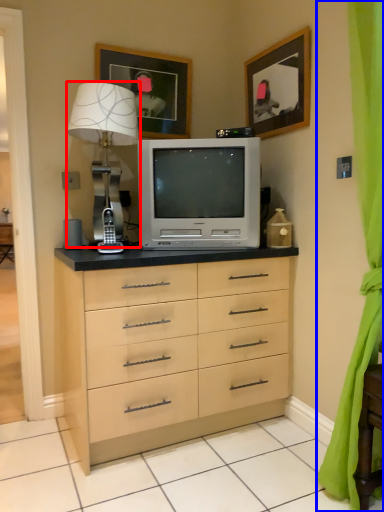
Question: Which of the following is the closest to the observer, table lamp (highlighted by a red box) or curtain (highlighted by a blue box)?

Choices:
 (A) table lamp
 (B) curtain

Answer: (B)